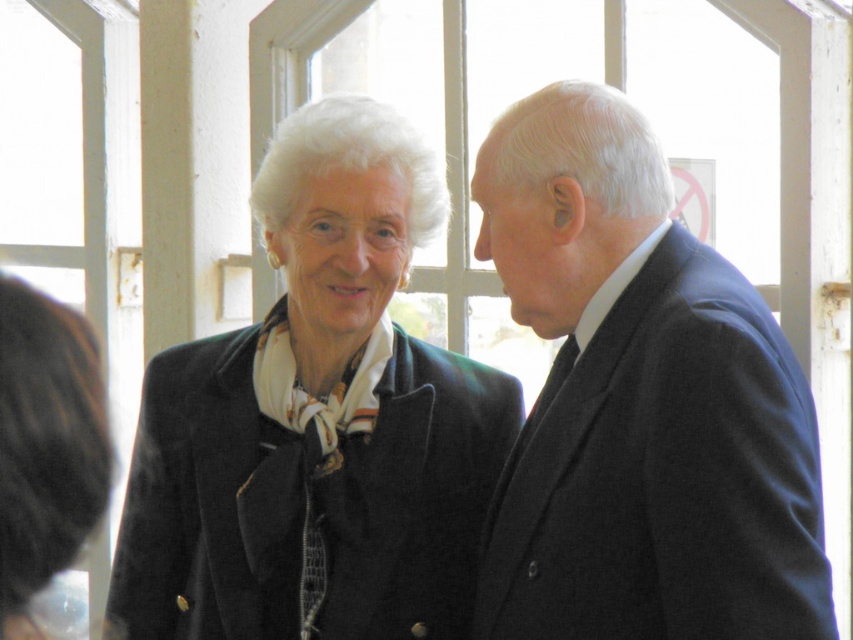
Can you confirm if dark blue suit at right is wider than matte black coat at center?

No.

Does point (706, 360) come farther from viewer compared to point (242, 449)?

No.

Locate an element on the screen. The height and width of the screenshot is (640, 853). dark blue suit at right is located at coordinates (639, 404).